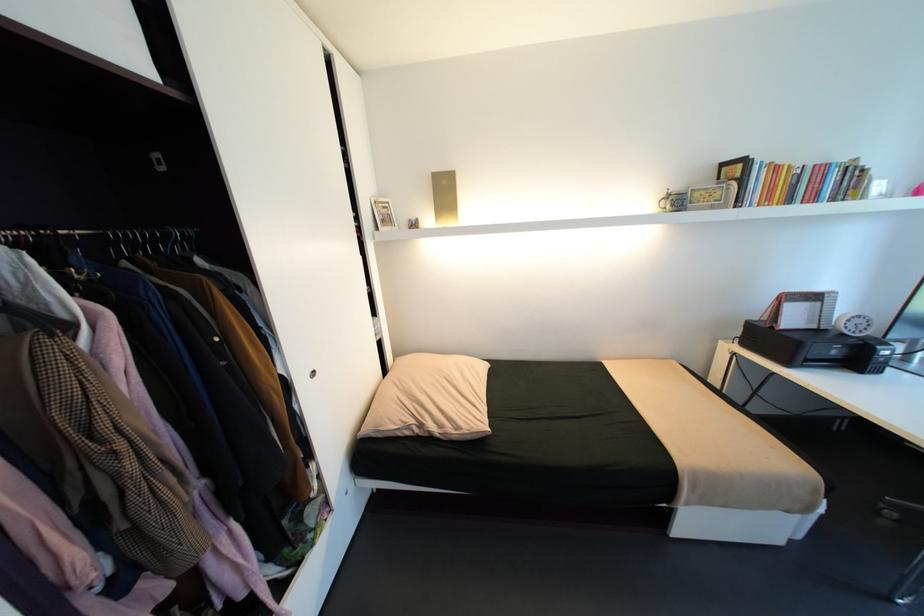
Find the location of `white analog clock`. white analog clock is located at coordinates point(854,323).